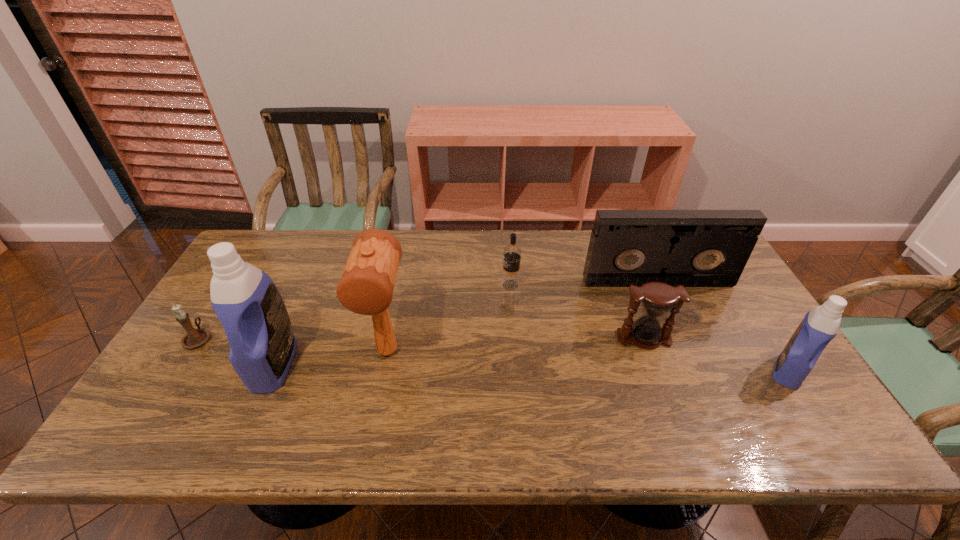
The width and height of the screenshot is (960, 540). I want to click on the taller detergent, so click(247, 302).

This screenshot has height=540, width=960. In order to click on the left detergent in this screenshot , I will do `click(247, 302)`.

Identify the location of the right detergent. The image size is (960, 540). (820, 325).

Identify the location of hourglass. This screenshot has height=540, width=960. coord(657,298).

The height and width of the screenshot is (540, 960). I want to click on the fourth object from left to right, so click(x=510, y=280).

Identify the location of videotape. The height and width of the screenshot is (540, 960). (695, 248).

This screenshot has height=540, width=960. What are the coordinates of `mallet` in the screenshot? It's located at (366, 287).

Where is `the shortest object`? The image size is (960, 540). the shortest object is located at coordinates (194, 338).

The width and height of the screenshot is (960, 540). What are the coordinates of `the leftmost object` in the screenshot? It's located at [x=194, y=338].

At what (x,y) coordinates should I click in order to perform the action: click on blank area located on the left of the second object from left to right. Please return your answer as a coordinate pair (x, y). This screenshot has height=540, width=960. Looking at the image, I should click on (192, 364).